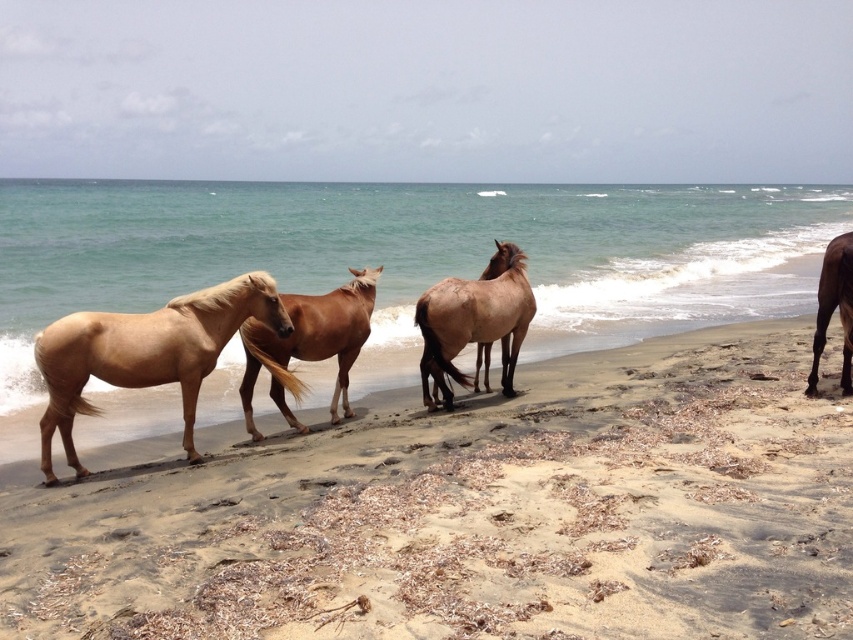
Question: Can you confirm if light brown sandy beach at center is positioned to the right of light brown glossy horse at left?

Choices:
 (A) no
 (B) yes

Answer: (B)

Question: Which of the following is the farthest from the observer?

Choices:
 (A) brown glossy horse at right
 (B) brown matte horse at center

Answer: (B)

Question: From the image, what is the correct spatial relationship of light brown glossy horse at left in relation to light brown glossy horse at center?

Choices:
 (A) above
 (B) below

Answer: (B)

Question: Does brown matte horse at center come in front of light brown horse at center?

Choices:
 (A) yes
 (B) no

Answer: (A)

Question: Which object appears closest to the camera in this image?

Choices:
 (A) brown matte horse at center
 (B) light brown horse at center

Answer: (A)

Question: Among these objects, which one is farthest from the camera?

Choices:
 (A) light brown sandy beach at center
 (B) light brown glossy horse at center
 (C) brown glossy horse at right
 (D) light brown glossy horse at left

Answer: (C)